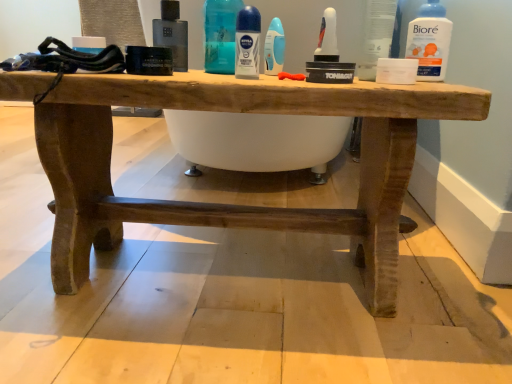
Question: Does rustic wood table at center have a greater height compared to transparent plastic container at upper right?

Choices:
 (A) no
 (B) yes

Answer: (B)

Question: Is rustic wood table at center far from transparent plastic container at upper right?

Choices:
 (A) yes
 (B) no

Answer: (B)

Question: Considering the relative sizes of rustic wood table at center and transparent plastic container at upper right in the image provided, is rustic wood table at center wider than transparent plastic container at upper right?

Choices:
 (A) no
 (B) yes

Answer: (B)

Question: Can you confirm if rustic wood table at center is shorter than transparent plastic container at upper right?

Choices:
 (A) no
 (B) yes

Answer: (A)

Question: Is rustic wood table at center bigger than transparent plastic container at upper right?

Choices:
 (A) no
 (B) yes

Answer: (B)

Question: Is rustic wood table at center in contact with transparent plastic container at upper right?

Choices:
 (A) yes
 (B) no

Answer: (B)

Question: Is rustic wood table at center facing towards matte black bottle at center, placed as the 1th mouthwash when sorted from left to right?

Choices:
 (A) yes
 (B) no

Answer: (B)

Question: Can you confirm if rustic wood table at center is taller than matte black bottle at center, placed as the 1th mouthwash when sorted from left to right?

Choices:
 (A) no
 (B) yes

Answer: (B)

Question: Is rustic wood table at center facing away from matte black bottle at center, placed as the 1th mouthwash when sorted from left to right?

Choices:
 (A) yes
 (B) no

Answer: (B)

Question: From a real-world perspective, is rustic wood table at center located beneath matte black bottle at center, the 3th mouthwash positioned from the right?

Choices:
 (A) no
 (B) yes

Answer: (B)

Question: Is rustic wood table at center at the right side of matte black bottle at center, placed as the 1th mouthwash when sorted from left to right?

Choices:
 (A) no
 (B) yes

Answer: (B)

Question: Could matte black bottle at center, the 3th mouthwash positioned from the right, be considered to be inside rustic wood table at center?

Choices:
 (A) no
 (B) yes

Answer: (A)

Question: Is blue glossy deodorant stick at center, the 2th cleaning product viewed from the left, wider than white plastic bottle at upper right, the third mouthwash when ordered from left to right?

Choices:
 (A) no
 (B) yes

Answer: (A)